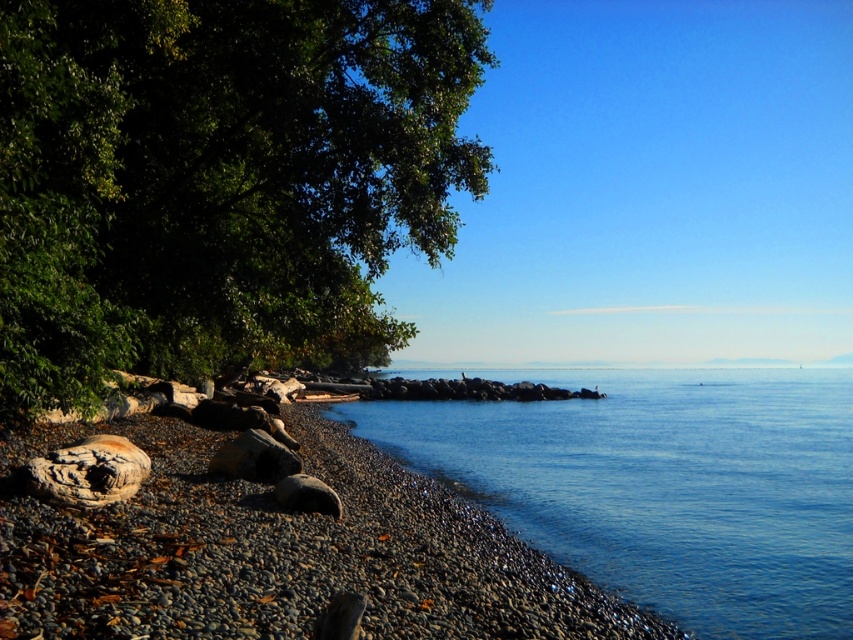
Is green leafy tree at left to the right of blue smooth water at center from the viewer's perspective?

In fact, green leafy tree at left is to the left of blue smooth water at center.

Between green leafy tree at left and blue smooth water at center, which one is positioned higher?

green leafy tree at left is higher up.

Measure the distance between point (289, 38) and camera.

Point (289, 38) is 44.80 feet away from camera.

What are the coordinates of `green leafy tree at left` in the screenshot? It's located at (219, 179).

Can you confirm if green leafy tree at left is smaller than smooth pebbles at lower left?

No.

From the picture: Is green leafy tree at left positioned at the back of smooth pebbles at lower left?

Yes, green leafy tree at left is behind smooth pebbles at lower left.

Where is `green leafy tree at left`? green leafy tree at left is located at coordinates (219, 179).

Between point (6, 577) and point (285, 486), which one is positioned behind?

The point (285, 486) is behind.

Identify the location of smooth pebbles at lower left. The height and width of the screenshot is (640, 853). (277, 550).